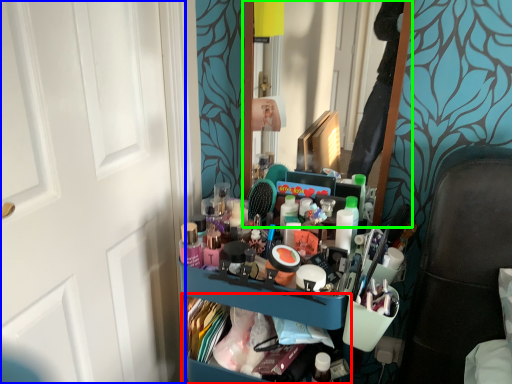
Question: Based on their relative distances, which object is farther from cabinet (highlighted by a red box)? Choose from door (highlighted by a blue box) and mirror (highlighted by a green box).

Choices:
 (A) door
 (B) mirror

Answer: (B)